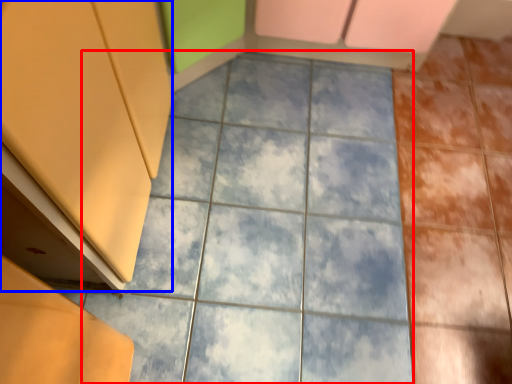
Question: Which of the following is the farthest to the observer, ceramic tile (highlighted by a red box) or cabinetry (highlighted by a blue box)?

Choices:
 (A) ceramic tile
 (B) cabinetry

Answer: (A)